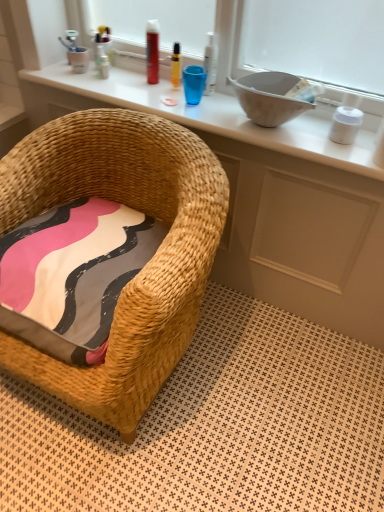
What are the coordinates of `free space between white plastic bottle at upper center, placed as the 5th toiletry when sorted from right to left, and shiny red can at upper center, positioned as the fourth toiletry in right-to-left order` in the screenshot? It's located at (128, 78).